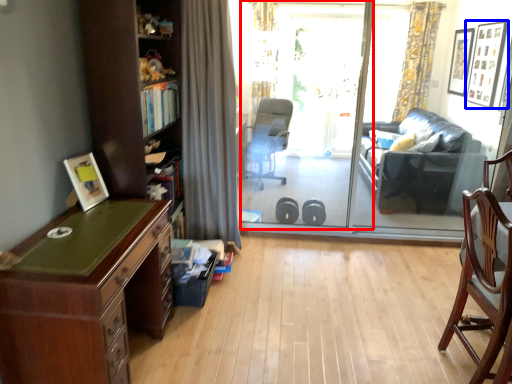
Question: Which object appears closest to the camera in this image, screen door (highlighted by a red box) or picture frame (highlighted by a blue box)?

Choices:
 (A) screen door
 (B) picture frame

Answer: (A)